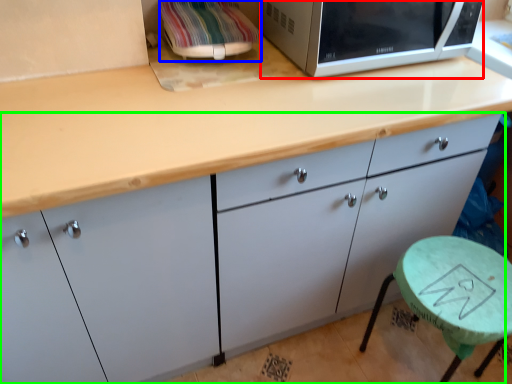
Question: Which object is the farthest from microwave oven (highlighted by a red box)? Choose among these: appliance (highlighted by a blue box) or cabinetry (highlighted by a green box).

Choices:
 (A) appliance
 (B) cabinetry

Answer: (B)